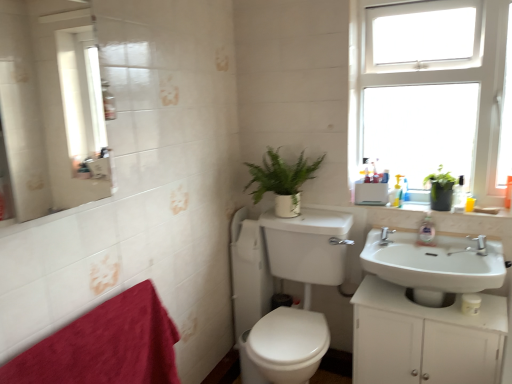
Locate an element on the screen. This screenshot has height=384, width=512. free space above white glossy sink at upper right (from a real-world perspective) is located at coordinates [x=426, y=202].